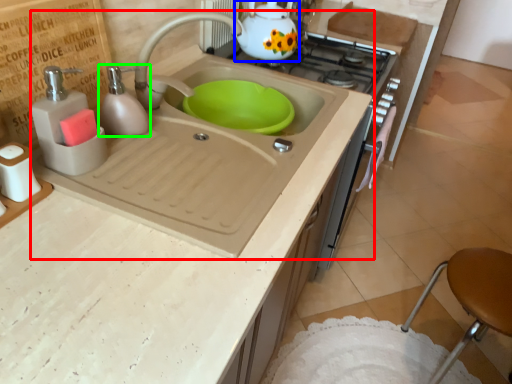
Question: Which object is positioned farthest from sink (highlighted by a red box)? Select from tea pot (highlighted by a blue box) and soap dispenser (highlighted by a green box).

Choices:
 (A) tea pot
 (B) soap dispenser

Answer: (A)